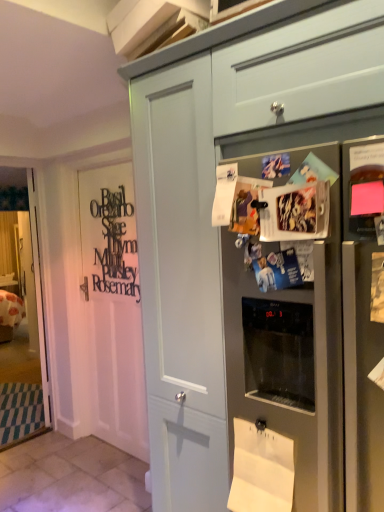
Where is `spots to the right of clear glass door at left`? This screenshot has height=512, width=384. spots to the right of clear glass door at left is located at coordinates (40, 445).